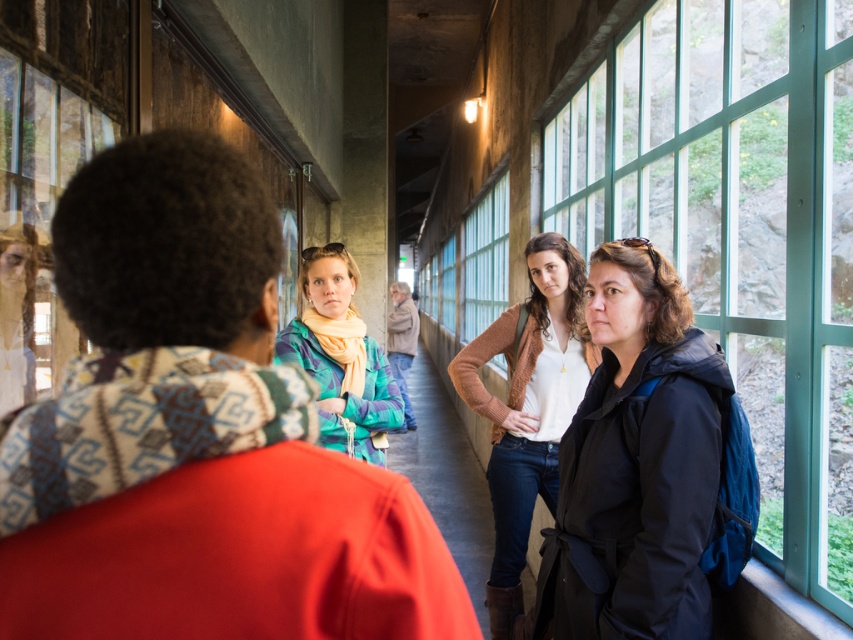
From the picture: You are trying to decide which item to take with you for warmth based on their sizes. Since the knitted wool scarf at center is smaller than the matte black jacket at center, which item would provide more coverage and warmth?

The matte black jacket at center provides more coverage and warmth because it is larger than the knitted wool scarf at center.

What is the object located at the coordinates point (196, 436) in the image?

The object located at point (196, 436) is the knitted wool scarf at center.

You are trying to decide whether to hang a decorative tapestry that is 1.5 meters wide on the wall between the knit sweater at center and the transparent glass window at upper left. Based on their widths, will the tapestry fit without overlapping either object?

The knit sweater at center is wider than the transparent glass window at upper left. Since the tapestry is 1.5 meters wide, it may not fit if the space between them is narrower than 1.5 meters. However, the description only provides information about their widths relative to each other, not the distance between them. Without knowing the exact spacing, it is impossible to determine if the tapestry will fit.